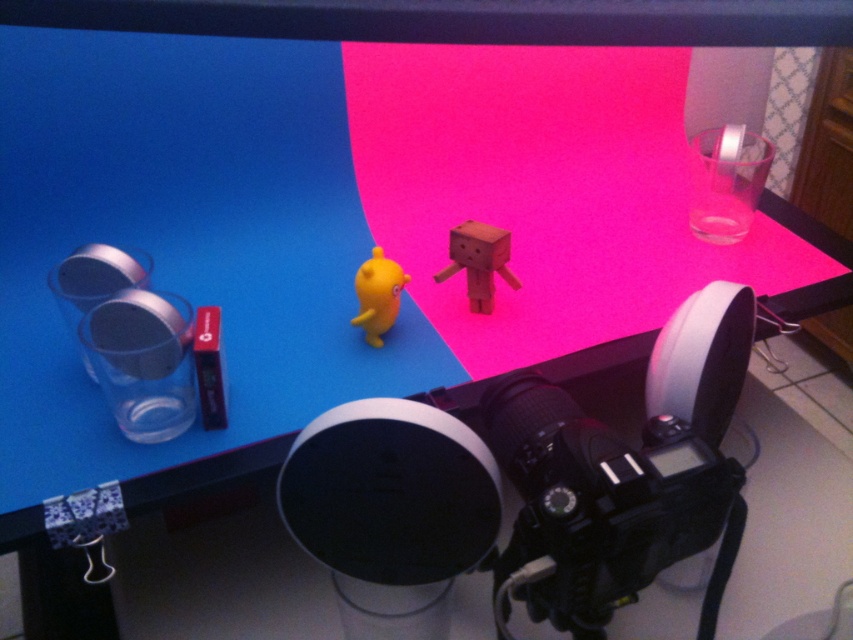
Question: Is wooden block at center positioned before matte yellow rubber duck at center?

Choices:
 (A) no
 (B) yes

Answer: (A)

Question: Which object is the farthest from the wooden block at center?

Choices:
 (A) black plastic video camera at center
 (B) matte yellow rubber duck at center

Answer: (A)

Question: Which point appears farthest from the camera in this image?

Choices:
 (A) (490, 308)
 (B) (393, 476)

Answer: (A)

Question: Which of the following is the farthest from the observer?

Choices:
 (A) matte yellow rubber duck at center
 (B) black plastic video camera at center

Answer: (A)

Question: Does black plastic video camera at center have a smaller size compared to wooden block at center?

Choices:
 (A) yes
 (B) no

Answer: (B)

Question: Can you confirm if wooden block at center is wider than matte yellow rubber duck at center?

Choices:
 (A) yes
 (B) no

Answer: (A)